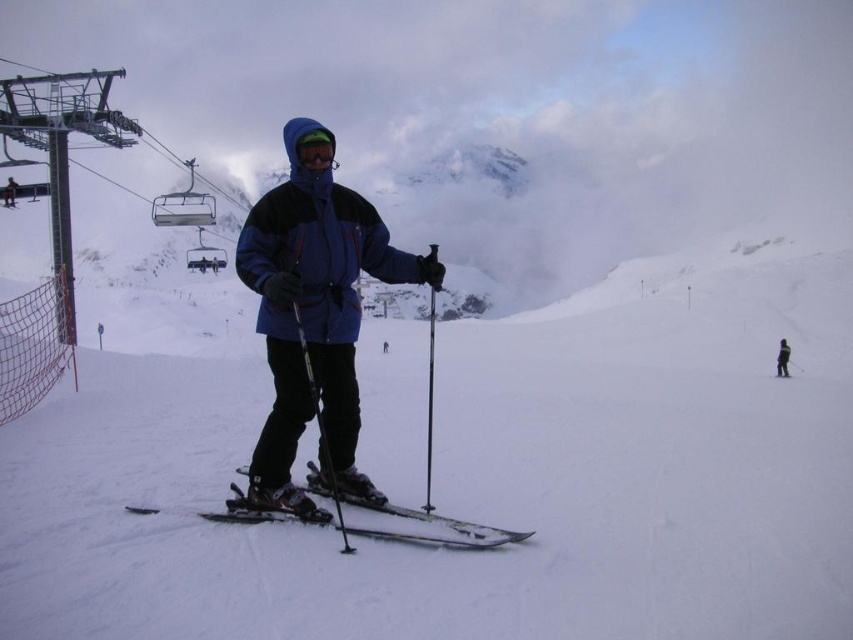
I want to click on black plastic ski pole at center, so click(320, 428).

Is point (347, 540) closer to camera compared to point (788, 353)?

Yes.

Is point (317, 387) positioned in front of point (782, 352)?

Yes, it is.

Where is `black plastic ski pole at center`? black plastic ski pole at center is located at coordinates (320, 428).

Which is more to the left, blue matte jacket at center or matte blue jacket at center?

matte blue jacket at center

Which is below, blue matte jacket at center or matte blue jacket at center?

blue matte jacket at center is below.

This screenshot has height=640, width=853. What do you see at coordinates (314, 316) in the screenshot? I see `blue matte jacket at center` at bounding box center [314, 316].

Image resolution: width=853 pixels, height=640 pixels. I want to click on blue matte jacket at center, so click(314, 316).

How far apart are black plastic ski pole at center and metallic ski pole at center?

A distance of 17.77 meters exists between black plastic ski pole at center and metallic ski pole at center.

In the scene shown: How far apart are black plastic ski pole at center and metallic ski pole at center?

They are 17.77 meters apart.

What do you see at coordinates (320, 428) in the screenshot?
I see `black plastic ski pole at center` at bounding box center [320, 428].

The image size is (853, 640). I want to click on black plastic ski pole at center, so click(x=320, y=428).